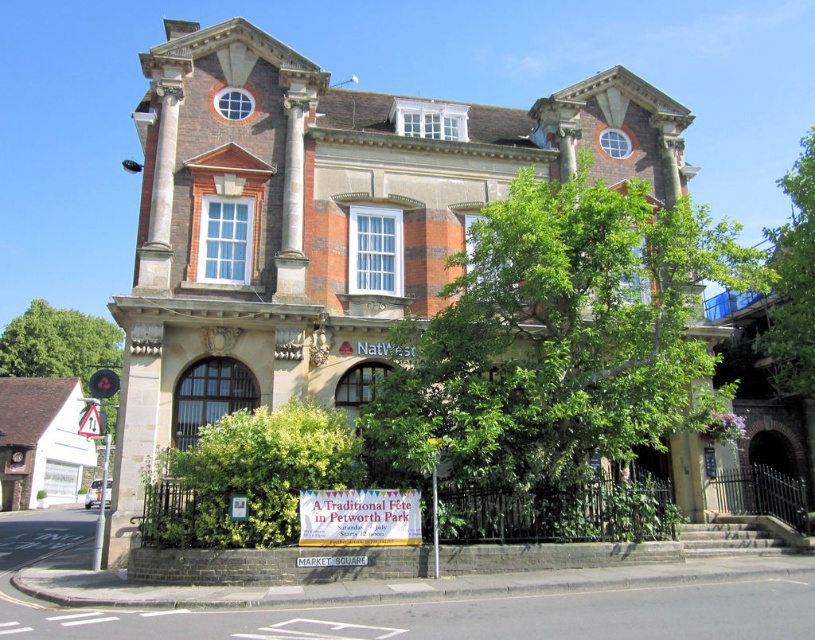
Question: Which object is positioned closest to the green leafy tree at upper right?

Choices:
 (A) green leafy tree at left
 (B) green leafy bush at lower center
 (C) yellow plastic triangular at left
 (D) white paper sign at center

Answer: (B)

Question: Does green leafy tree at left appear on the left side of white paper sign at center?

Choices:
 (A) no
 (B) yes

Answer: (B)

Question: Which of the following is the closest to the observer?

Choices:
 (A) yellow plastic triangular at left
 (B) white paper sign at center

Answer: (B)

Question: Is green leafy tree at center to the right of green leafy tree at left from the viewer's perspective?

Choices:
 (A) no
 (B) yes

Answer: (B)

Question: Which of the following is the closest to the observer?

Choices:
 (A) (305, 524)
 (B) (304, 483)

Answer: (A)

Question: Is green leafy bush at lower center below white paper sign at center?

Choices:
 (A) no
 (B) yes

Answer: (A)